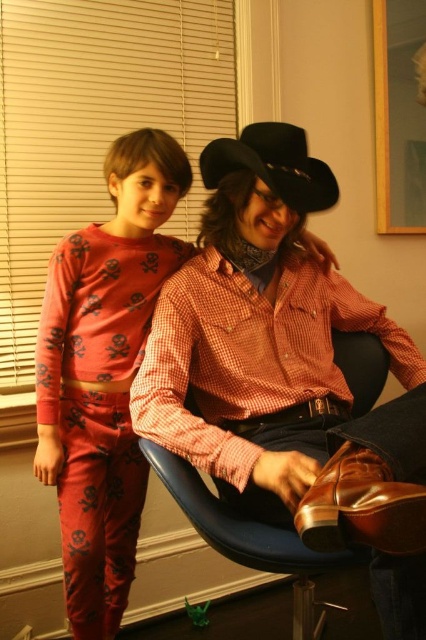
What is the color of the clothing item at the coordinates point (103, 372) in the image?

The point (103, 372) is on matte red pajamas at left, so the color is red.

You are a delivery robot that needs to place a package on the blue plastic swivel chair at center. The package is 3 feet long. Can you safely place it there without exceeding the chair dimensions?

The blue plastic swivel chair at center is 3.45 feet from camera. However, the distance from the camera does not indicate the chair dimensions. Without knowing the chair width or length, it is impossible to determine if the 3 feet long package will fit. Additional measurements are required.

What are the exact coordinates of the matte red pajamas at left in the image?

The exact coordinates of the matte red pajamas at left are at point [103,372].